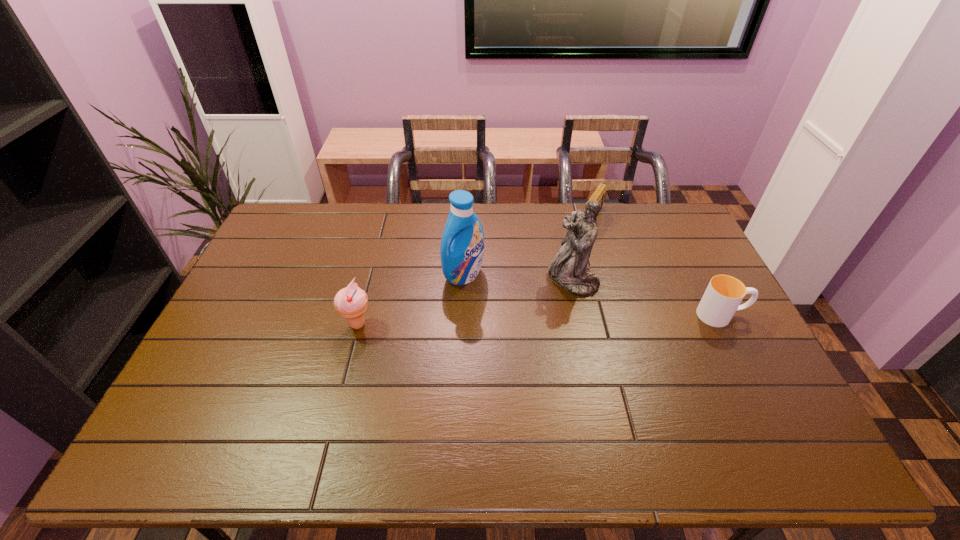
Locate an element on the screen. The height and width of the screenshot is (540, 960). vacant space on the desktop that is between the third shortest object and the cup and is positioned on the front-facing side of the figurine is located at coordinates (505, 321).

I want to click on free spot on the desktop that is between the icecream and the rightmost object and is positioned at the barrel of the farthest object, so click(525, 320).

This screenshot has height=540, width=960. I want to click on free spot on the desktop that is between the leftmost object and the rightmost object and is positioned on the front-facing side of the second object from left to right, so click(x=517, y=320).